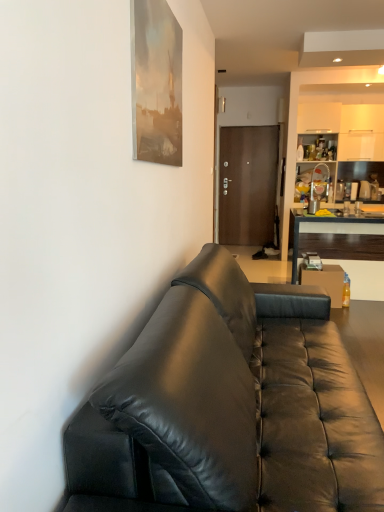
What is the approximate height of brown matte door at center?

brown matte door at center is 2.05 meters tall.

What is the approximate height of matte wood cabinet at upper right?

matte wood cabinet at upper right is 31.30 inches tall.

Image resolution: width=384 pixels, height=512 pixels. Find the location of `matte wood cabinet at upper right`. matte wood cabinet at upper right is located at coordinates (347, 127).

The image size is (384, 512). Describe the element at coordinates (229, 406) in the screenshot. I see `black leather couch at center` at that location.

What do you see at coordinates (313, 206) in the screenshot? I see `matte silver cup at center` at bounding box center [313, 206].

Identify the location of brown matte door at center. The image size is (384, 512). (248, 184).

Looking at their sizes, would you say dark wood desk at right is wider or thinner than matte silver cup at center?

dark wood desk at right is wider than matte silver cup at center.

Considering the sizes of objects dark wood desk at right and matte silver cup at center in the image provided, who is shorter, dark wood desk at right or matte silver cup at center?

matte silver cup at center is shorter.

Find the location of a particular element. The image size is (384, 512). coffee cup located on the left of dark wood desk at right is located at coordinates (313, 206).

Which of these two, matte silver cup at center or brown matte door at center, stands taller?

brown matte door at center is taller.

In terms of size, does matte silver cup at center appear bigger or smaller than brown matte door at center?

matte silver cup at center is smaller than brown matte door at center.

Is matte silver cup at center positioned in front of brown matte door at center?

Yes, matte silver cup at center is in front of brown matte door at center.

Between point (311, 206) and point (235, 150), which one is positioned in front?

Positioned in front is point (311, 206).

Considering the sizes of objects brown matte door at center and dark wood desk at right in the image provided, who is wider, brown matte door at center or dark wood desk at right?

With larger width is dark wood desk at right.

Between brown matte door at center and dark wood desk at right, which one appears on the left side from the viewer's perspective?

Positioned to the left is brown matte door at center.

From a real-world perspective, who is located lower, brown matte door at center or dark wood desk at right?

From a 3D spatial view, dark wood desk at right is below.

How different are the orientations of translucent plastic bottle at right and matte silver cup at center in degrees?

There is a 90.9-degree angle between the facing directions of translucent plastic bottle at right and matte silver cup at center.

Is translucent plastic bottle at right placed right next to matte silver cup at center?

translucent plastic bottle at right is not next to matte silver cup at center, and they're not touching.

From the image's perspective, is translucent plastic bottle at right located above matte silver cup at center?

No.

Is point (312, 203) closer or farther from the camera than point (216, 280)?

Point (312, 203) is farther from the camera than point (216, 280).

I want to click on coffee cup above the black leather couch at center (from a real-world perspective), so click(313, 206).

In terms of width, does matte silver cup at center look wider or thinner when compared to black leather couch at center?

In the image, matte silver cup at center appears to be more narrow than black leather couch at center.

From a real-world perspective, between translucent plastic bottle at right and brown matte door at center, who is vertically higher?

brown matte door at center.

Is translucent plastic bottle at right completely or partially outside of brown matte door at center?

Yes, translucent plastic bottle at right is outside of brown matte door at center.

From the picture: Between translucent plastic bottle at right and brown matte door at center, which one has larger width?

translucent plastic bottle at right.

How many degrees apart are the facing directions of translucent plastic bottle at right and brown matte door at center?

The facing directions of translucent plastic bottle at right and brown matte door at center are 0.215 degrees apart.

Can you tell me how much brown matte door at center and matte silver cup at center differ in facing direction?

The angle between the facing direction of brown matte door at center and the facing direction of matte silver cup at center is 90.7 degrees.

Considering the positions of objects brown matte door at center and matte silver cup at center in the image provided, who is more to the right, brown matte door at center or matte silver cup at center?

matte silver cup at center is more to the right.

Does brown matte door at center turn towards matte silver cup at center?

Yes, brown matte door at center is aimed at matte silver cup at center.

Based on their sizes in the image, would you say brown matte door at center is bigger or smaller than matte silver cup at center?

Clearly, brown matte door at center is larger in size than matte silver cup at center.

Identify the location of coffee cup above the dark wood desk at right (from the image's perspective). (313, 206).

At what (x,y) coordinates should I click in order to perform the action: click on coffee cup lying below the brown matte door at center (from the image's perspective). Please return your answer as a coordinate pair (x, y). Looking at the image, I should click on (313, 206).

Estimate the real-world distances between objects in this image. Which object is closer to matte wood cabinet at upper right, matte silver cup at center or translucent plastic bottle at right?

matte silver cup at center lies closer to matte wood cabinet at upper right than the other object.

When comparing their distances from black leather couch at center, does translucent plastic bottle at right or dark wood desk at right seem further?

translucent plastic bottle at right lies further to black leather couch at center than the other object.

When comparing their distances from brown matte door at center, does translucent plastic bottle at right or matte wood cabinet at upper right seem further?

translucent plastic bottle at right is further to brown matte door at center.

From the image, which object appears to be nearer to translucent plastic bottle at right, matte wood cabinet at upper right or dark wood desk at right?

Among the two, dark wood desk at right is located nearer to translucent plastic bottle at right.

Consider the image. Based on their spatial positions, is brown matte door at center or matte wood cabinet at upper right closer to translucent plastic bottle at right?

matte wood cabinet at upper right lies closer to translucent plastic bottle at right than the other object.

Looking at the image, which one is located closer to brown matte door at center, black leather couch at center or matte silver cup at center?

Among the two, matte silver cup at center is located nearer to brown matte door at center.

Based on their spatial positions, is brown matte door at center or translucent plastic bottle at right further from matte silver cup at center?

Among the two, translucent plastic bottle at right is located further to matte silver cup at center.

Looking at the image, which one is located closer to matte silver cup at center, dark wood desk at right or translucent plastic bottle at right?

dark wood desk at right is positioned closer to the anchor matte silver cup at center.

Identify the location of cabinetry between translucent plastic bottle at right and brown matte door at center from front to back. This screenshot has height=512, width=384. (347, 127).

In order to click on coffee cup positioned between black leather couch at center and matte wood cabinet at upper right from near to far in this screenshot , I will do `click(313, 206)`.

Where is `desk between black leather couch at center and brown matte door at center along the z-axis`? The image size is (384, 512). desk between black leather couch at center and brown matte door at center along the z-axis is located at coordinates (335, 239).

Identify the location of bottle located between black leather couch at center and matte wood cabinet at upper right in the depth direction. (346, 291).